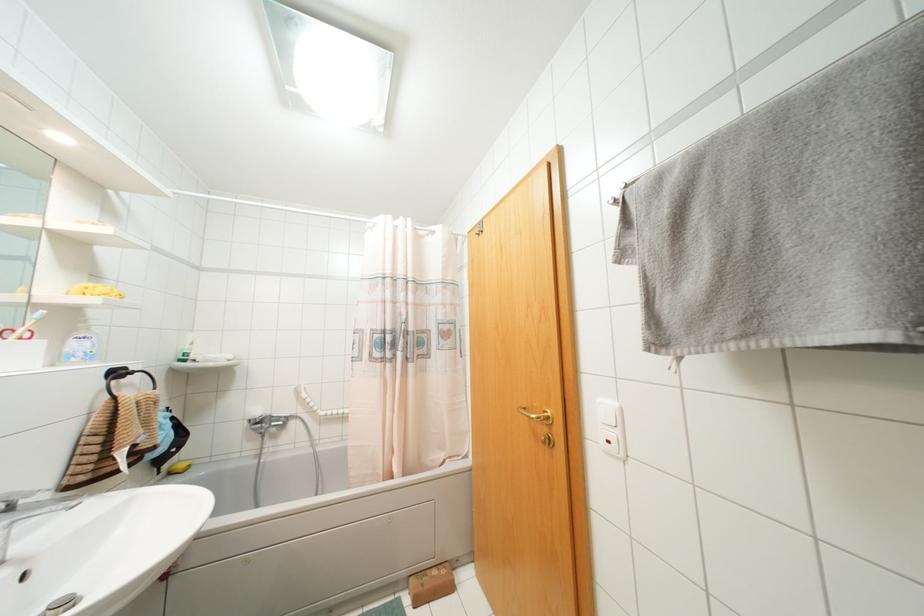
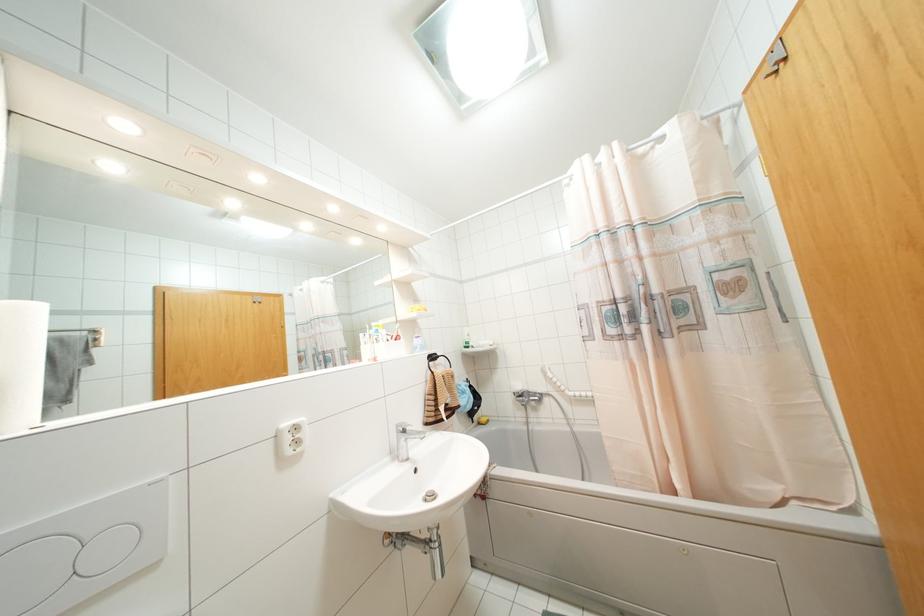
Locate, in the second image, the point that corresponds to pixel 190 342 in the first image.

(468, 334)